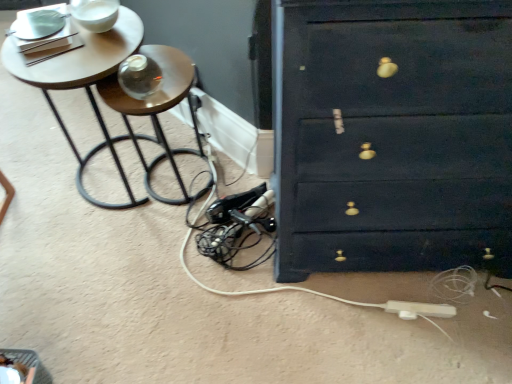
What do you see at coordinates (392, 135) in the screenshot? I see `matte dark blue chest of drawers at right` at bounding box center [392, 135].

The width and height of the screenshot is (512, 384). What do you see at coordinates (154, 102) in the screenshot?
I see `wooden side table at left` at bounding box center [154, 102].

In order to face white plastic extension cord at lower right, should I rotate leftwards or rightwards?

A 20.979 degree turn to the right will do.

This screenshot has height=384, width=512. Describe the element at coordinates (83, 81) in the screenshot. I see `wooden round table at upper left` at that location.

Locate an element on the screen. matte dark blue chest of drawers at right is located at coordinates (392, 135).

From the image's perspective, between wooden side table at left and wooden round table at upper left, which one is located above?

From the image's view, wooden round table at upper left is above.

Between wooden side table at left and wooden round table at upper left, which one has more height?

wooden round table at upper left is taller.

Which is behind, point (175, 200) or point (90, 152)?

The point (90, 152) is farther from the camera.

The height and width of the screenshot is (384, 512). Find the location of `table above the wooden side table at left (from the image's perspective)`. table above the wooden side table at left (from the image's perspective) is located at coordinates (83, 81).

You are a GUI agent. You are given a task and a screenshot of the screen. Output one action in this format:
    pyautogui.click(x=<x>, y=<y>)
    Task: Click on the side table above the white plastic extension cord at lower right (from a real-world perspective)
    Image resolution: width=512 pixels, height=384 pixels.
    Given the screenshot: What is the action you would take?
    pyautogui.click(x=154, y=102)

Can you confirm if white plastic extension cord at lower right is smaller than wooden side table at left?

Correct, white plastic extension cord at lower right occupies less space than wooden side table at left.

Does white plastic extension cord at lower right have a lesser height compared to wooden side table at left?

Correct, white plastic extension cord at lower right is not as tall as wooden side table at left.

Find the location of a particular element. extension cord below the wooden round table at upper left (from the image's perspective) is located at coordinates (418, 309).

From the image's perspective, which one is positioned lower, white plastic extension cord at lower right or wooden round table at upper left?

white plastic extension cord at lower right.

Which object is further away from the camera, white plastic extension cord at lower right or wooden round table at upper left?

white plastic extension cord at lower right is further away from the camera.

Can you confirm if white plastic extension cord at lower right is thinner than wooden round table at upper left?

Yes.

In the scene shown: In terms of width, does wooden round table at upper left look wider or thinner when compared to wooden side table at left?

Clearly, wooden round table at upper left has more width compared to wooden side table at left.

From the image's perspective, is wooden round table at upper left located beneath wooden side table at left?

No.

Is point (104, 124) closer to camera compared to point (106, 88)?

No.

Consider the image. Is wooden side table at left closer to camera compared to white plastic extension cord at lower right?

Yes.

From the image's perspective, is wooden side table at left located above white plastic extension cord at lower right?

Yes, from the image's perspective, wooden side table at left is over white plastic extension cord at lower right.

Is wooden side table at left surrounding white plastic extension cord at lower right?

No, wooden side table at left does not contain white plastic extension cord at lower right.

Is wooden side table at left next to white plastic extension cord at lower right?

No, wooden side table at left is not beside white plastic extension cord at lower right.

From a real-world perspective, who is located higher, matte dark blue chest of drawers at right or wooden round table at upper left?

matte dark blue chest of drawers at right is physically above.

Considering the relative sizes of matte dark blue chest of drawers at right and wooden round table at upper left in the image provided, is matte dark blue chest of drawers at right bigger than wooden round table at upper left?

Correct, matte dark blue chest of drawers at right is larger in size than wooden round table at upper left.

Is matte dark blue chest of drawers at right inside the boundaries of wooden round table at upper left, or outside?

matte dark blue chest of drawers at right exists outside the volume of wooden round table at upper left.

Between matte dark blue chest of drawers at right and wooden round table at upper left, which one has less height?

Standing shorter between the two is wooden round table at upper left.

Between matte dark blue chest of drawers at right and white plastic extension cord at lower right, which one has more height?

matte dark blue chest of drawers at right is taller.

From the picture: Considering their positions, is matte dark blue chest of drawers at right located in front of or behind white plastic extension cord at lower right?

In the image, matte dark blue chest of drawers at right appears in front of white plastic extension cord at lower right.

What's the angular difference between matte dark blue chest of drawers at right and white plastic extension cord at lower right's facing directions?

matte dark blue chest of drawers at right and white plastic extension cord at lower right are facing 7.77 degrees away from each other.

Is matte dark blue chest of drawers at right in contact with white plastic extension cord at lower right?

No, matte dark blue chest of drawers at right is not touching white plastic extension cord at lower right.

Identify the location of table that appears above the wooden side table at left (from a real-world perspective). [83, 81].

The height and width of the screenshot is (384, 512). Identify the location of extension cord that is behind the wooden side table at left. (418, 309).

When comparing their distances from wooden side table at left, does wooden round table at upper left or white plastic extension cord at lower right seem further?

Among the two, white plastic extension cord at lower right is located further to wooden side table at left.

Looking at the image, which one is located further to matte dark blue chest of drawers at right, wooden side table at left or white plastic extension cord at lower right?

Based on the image, wooden side table at left appears to be further to matte dark blue chest of drawers at right.

From the image, which object appears to be farther from wooden round table at upper left, wooden side table at left or white plastic extension cord at lower right?

white plastic extension cord at lower right.

When comparing their distances from white plastic extension cord at lower right, does matte dark blue chest of drawers at right or wooden round table at upper left seem further?

wooden round table at upper left is further to white plastic extension cord at lower right.

Estimate the real-world distances between objects in this image. Which object is further from white plastic extension cord at lower right, wooden side table at left or matte dark blue chest of drawers at right?

Among the two, wooden side table at left is located further to white plastic extension cord at lower right.

Looking at the image, which one is located further to wooden side table at left, matte dark blue chest of drawers at right or wooden round table at upper left?

matte dark blue chest of drawers at right is further to wooden side table at left.

Estimate the real-world distances between objects in this image. Which object is further from wooden round table at upper left, matte dark blue chest of drawers at right or wooden side table at left?

The object further to wooden round table at upper left is matte dark blue chest of drawers at right.

Based on their spatial positions, is white plastic extension cord at lower right or wooden round table at upper left closer to matte dark blue chest of drawers at right?

white plastic extension cord at lower right.

The image size is (512, 384). Find the location of `side table between wooden round table at upper left and matte dark blue chest of drawers at right`. side table between wooden round table at upper left and matte dark blue chest of drawers at right is located at coordinates click(154, 102).

In order to click on the chest of drawers situated between wooden round table at upper left and white plastic extension cord at lower right from left to right in this screenshot , I will do `click(392, 135)`.

You are a GUI agent. You are given a task and a screenshot of the screen. Output one action in this format:
    pyautogui.click(x=<x>, y=<y>)
    Task: Click on the chest of drawers between wooden side table at left and white plastic extension cord at lower right from left to right
    This screenshot has width=512, height=384.
    Given the screenshot: What is the action you would take?
    pyautogui.click(x=392, y=135)

Where is `side table located between wooden round table at upper left and white plastic extension cord at lower right in the left-right direction`? Image resolution: width=512 pixels, height=384 pixels. side table located between wooden round table at upper left and white plastic extension cord at lower right in the left-right direction is located at coordinates (154, 102).